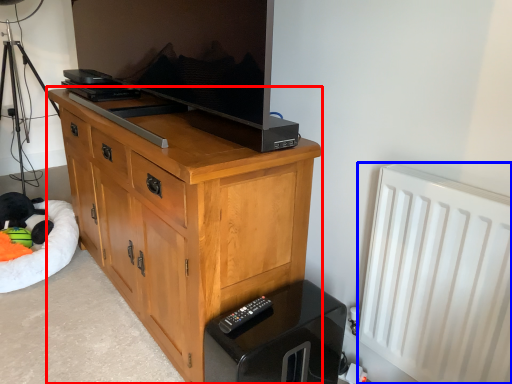
Question: Among these objects, which one is nearest to the camera, chest of drawers (highlighted by a red box) or radiator (highlighted by a blue box)?

Choices:
 (A) chest of drawers
 (B) radiator

Answer: (B)